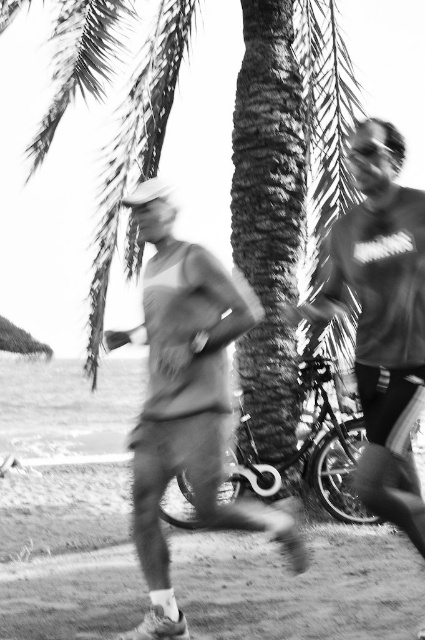
Where is `smooth fabric shirt at center`? The width and height of the screenshot is (425, 640). smooth fabric shirt at center is located at coordinates (186, 401).

Which is more to the right, smooth fabric shirt at center or matte gray t-shirt at right?

matte gray t-shirt at right

Which is in front, point (152, 563) or point (405, 532)?

Point (405, 532) is more forward.

Find the location of a particular element. The height and width of the screenshot is (640, 425). smooth fabric shirt at center is located at coordinates (186, 401).